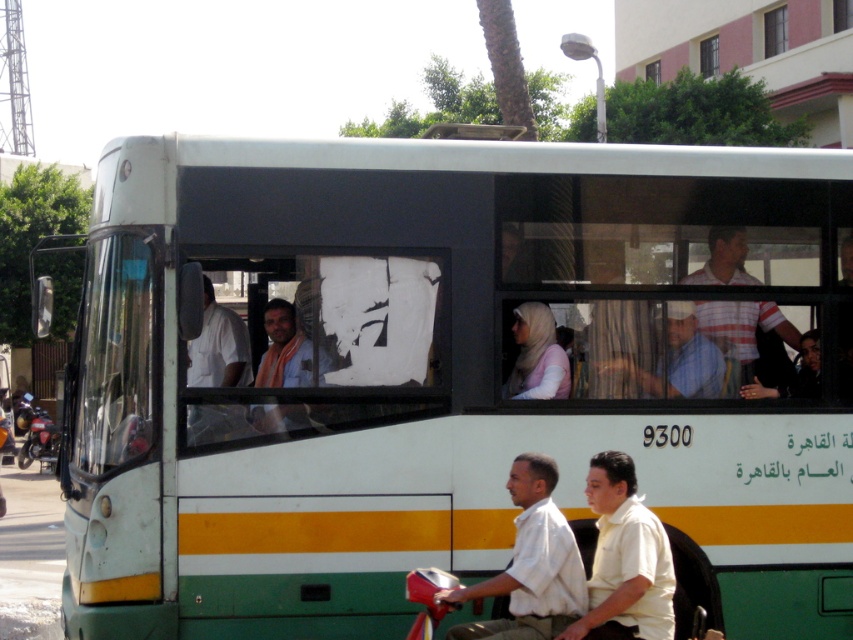
Question: Which object is positioned closest to the orange scarf at center?

Choices:
 (A) blue striped shirt at center
 (B) white matte shirt at center

Answer: (B)

Question: Which of the following is the farthest from the observer?

Choices:
 (A) orange scarf at center
 (B) blue striped shirt at center
 (C) white matte shirt at center
 (D) striped cotton shirt at center

Answer: (D)

Question: Can you confirm if blue striped shirt at center is positioned to the right of shiny black motorcycle at left?

Choices:
 (A) yes
 (B) no

Answer: (A)

Question: Where is white cotton shirt at center located in relation to orange scarf at center in the image?

Choices:
 (A) above
 (B) below

Answer: (B)

Question: Can you confirm if striped cotton shirt at center is bigger than shiny black motorcycle at left?

Choices:
 (A) yes
 (B) no

Answer: (A)

Question: Which of the following is the closest to the observer?

Choices:
 (A) white matte shirt at center
 (B) orange scarf at center

Answer: (A)